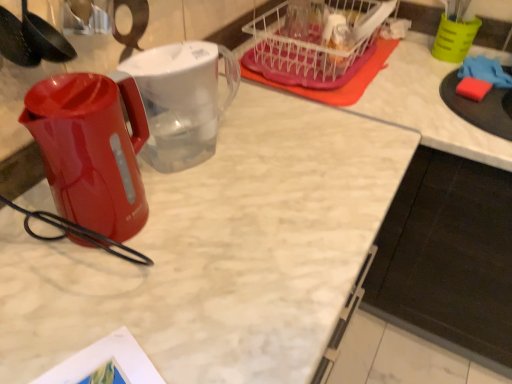
Question: Based on their positions, is black plastic spoon at upper left located to the left or right of transparent plastic pitcher at center?

Choices:
 (A) right
 (B) left

Answer: (B)

Question: Is black plastic spoon at upper left wider or thinner than transparent plastic pitcher at center?

Choices:
 (A) wide
 (B) thin

Answer: (B)

Question: Which of these objects is positioned farthest from the green plastic cup at upper right?

Choices:
 (A) black plastic spoon at upper left
 (B) translucent plastic basket at upper right
 (C) transparent plastic pitcher at center
 (D) black matte cabinet at lower right
 (E) glossy plastic kettle at left

Answer: (A)

Question: Which is farther from the black plastic spoon at upper left?

Choices:
 (A) transparent plastic pitcher at center
 (B) green plastic cup at upper right
 (C) translucent plastic basket at upper right
 (D) black matte cabinet at lower right
 (E) glossy plastic kettle at left

Answer: (B)